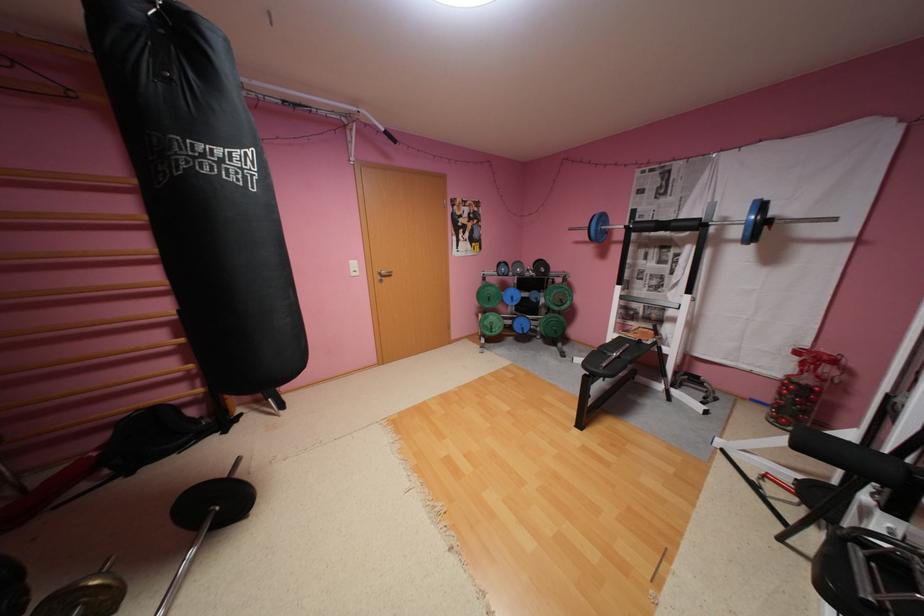
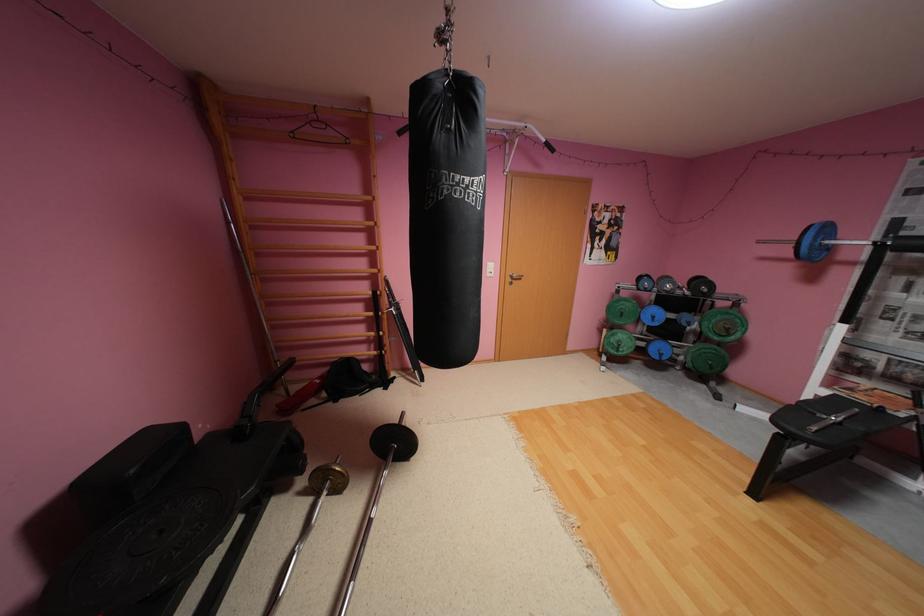
In the second image, find the point that corresponds to (x=572, y=304) in the first image.

(737, 334)